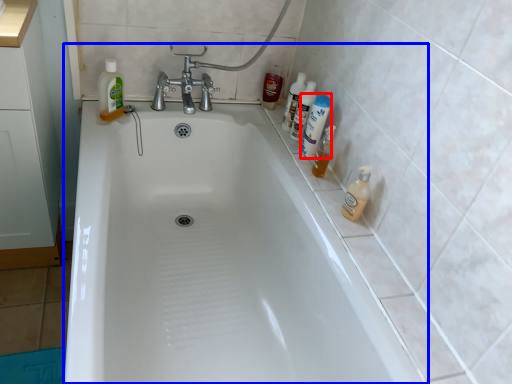
Question: Which of the following is the closest to the observer, cleaning product (highlighted by a red box) or bathtub (highlighted by a blue box)?

Choices:
 (A) cleaning product
 (B) bathtub

Answer: (B)